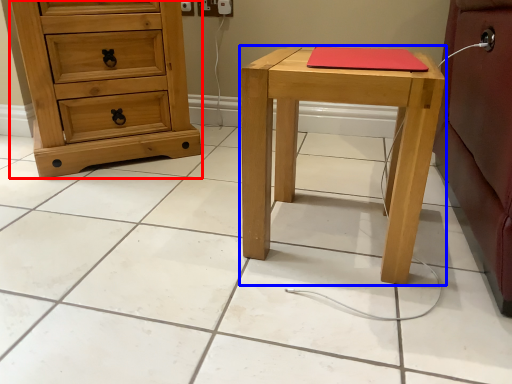
Question: Among these objects, which one is farthest to the camera, chest of drawers (highlighted by a red box) or stool (highlighted by a blue box)?

Choices:
 (A) chest of drawers
 (B) stool

Answer: (A)